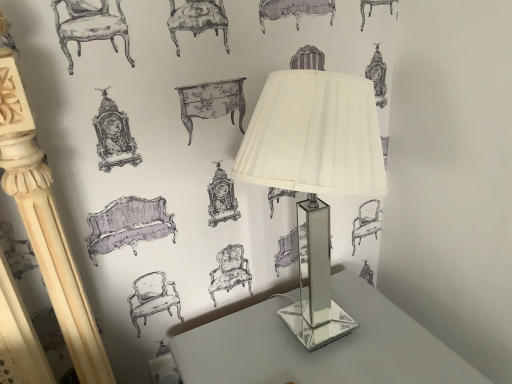
Identify the location of clear glass lamp at center. (314, 175).

Describe the element at coordinates (314, 175) in the screenshot. I see `clear glass lamp at center` at that location.

Measure the distance between point (236, 316) and camera.

The depth of point (236, 316) is 34.96 inches.

This screenshot has width=512, height=384. What do you see at coordinates (321, 347) in the screenshot?
I see `clear glass table at center` at bounding box center [321, 347].

The image size is (512, 384). What are the coordinates of `clear glass table at center` in the screenshot? It's located at (321, 347).

You are a GUI agent. You are given a task and a screenshot of the screen. Output one action in this format:
    pyautogui.click(x=<x>, y=<y>)
    Task: Click on the clear glass lamp at center
    The image size is (512, 384).
    Given the screenshot: What is the action you would take?
    pyautogui.click(x=314, y=175)

Considering the relative positions of clear glass lamp at center and clear glass table at center in the image provided, is clear glass lamp at center to the right of clear glass table at center from the viewer's perspective?

No.

Is clear glass lamp at center in front of clear glass table at center?

Yes, it is.

Is point (358, 113) behind point (378, 330)?

No.

From the image's perspective, relative to clear glass table at center, is clear glass lamp at center above or below?

From the image's perspective, clear glass lamp at center appears above clear glass table at center.

From a real-world perspective, which is physically below, clear glass lamp at center or clear glass table at center?

clear glass table at center, from a real-world perspective.

Does clear glass lamp at center have a greater width compared to clear glass table at center?

No, clear glass lamp at center is not wider than clear glass table at center.

Does clear glass lamp at center have a greater height compared to clear glass table at center?

Yes, clear glass lamp at center is taller than clear glass table at center.

Considering the sizes of objects clear glass lamp at center and clear glass table at center in the image provided, who is bigger, clear glass lamp at center or clear glass table at center?

clear glass table at center is bigger.

Is clear glass lamp at center not within clear glass table at center?

Absolutely, clear glass lamp at center is external to clear glass table at center.

Does clear glass lamp at center touch clear glass table at center?

Yes, clear glass lamp at center is touching clear glass table at center.

From the picture: Is clear glass lamp at center looking in the opposite direction of clear glass table at center?

No, clear glass lamp at center is not facing away from clear glass table at center.

How different are the orientations of clear glass lamp at center and clear glass table at center in degrees?

3.83 degrees.

This screenshot has width=512, height=384. I want to click on lamp above the clear glass table at center (from the image's perspective), so click(314, 175).

Between clear glass table at center and clear glass lamp at center, which one appears on the right side from the viewer's perspective?

From the viewer's perspective, clear glass table at center appears more on the right side.

Does clear glass table at center come behind clear glass lamp at center?

Yes, the depth of clear glass table at center is greater than that of clear glass lamp at center.

Which is behind, point (183, 365) or point (350, 79)?

Positioned behind is point (183, 365).

From the image's perspective, which one is positioned lower, clear glass table at center or clear glass lamp at center?

clear glass table at center is shown below in the image.

From a real-world perspective, which object rests below the other?

clear glass table at center is physically lower.

Considering the relative sizes of clear glass table at center and clear glass lamp at center in the image provided, is clear glass table at center wider than clear glass lamp at center?

Indeed, clear glass table at center has a greater width compared to clear glass lamp at center.

Between clear glass table at center and clear glass lamp at center, which one has less height?

With less height is clear glass table at center.

Between clear glass table at center and clear glass lamp at center, which one has smaller size?

clear glass lamp at center.

Could clear glass lamp at center be considered to be inside clear glass table at center?

Actually, clear glass lamp at center is outside clear glass table at center.

Is clear glass table at center positioned far away from clear glass lamp at center?

No, clear glass table at center is in close proximity to clear glass lamp at center.

Is clear glass lamp at center at the back of clear glass table at center?

No, clear glass table at center's orientation is not away from clear glass lamp at center.

Locate an element on the screen. lamp above the clear glass table at center (from a real-world perspective) is located at coordinates (314, 175).

Locate an element on the screen. The height and width of the screenshot is (384, 512). lamp that is above the clear glass table at center (from the image's perspective) is located at coordinates (314, 175).

This screenshot has width=512, height=384. What are the coordinates of `lamp located in front of the clear glass table at center` in the screenshot? It's located at (314, 175).